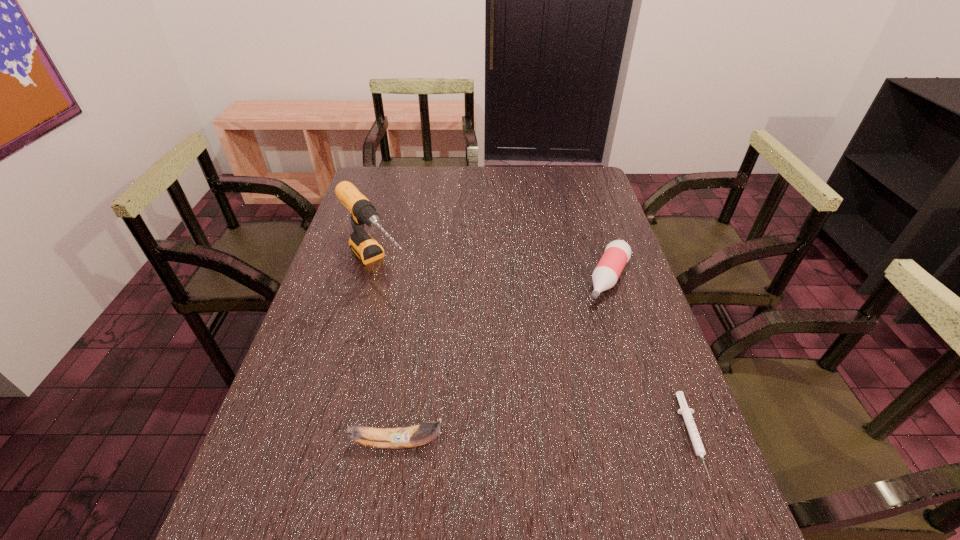
The image size is (960, 540). What are the coordinates of `free location at the right edge` in the screenshot? It's located at (606, 377).

Where is `vacant space at the far left corner of the desktop`? The height and width of the screenshot is (540, 960). vacant space at the far left corner of the desktop is located at coordinates (382, 181).

At what (x,y) coordinates should I click in order to perform the action: click on vacant space at the near left corner of the desktop. Please return your answer as a coordinate pair (x, y). This screenshot has height=540, width=960. Looking at the image, I should click on tap(286, 508).

At what (x,y) coordinates should I click in order to perform the action: click on free space between the banana and the shortest object. Please return your answer as a coordinate pair (x, y). This screenshot has height=540, width=960. Looking at the image, I should click on (545, 440).

Find the location of a particular element. vacant space that is in between the syringe and the tallest object is located at coordinates (535, 350).

Where is `free space that is in between the bottle and the tallest object`? The width and height of the screenshot is (960, 540). free space that is in between the bottle and the tallest object is located at coordinates (492, 272).

You are a GUI agent. You are given a task and a screenshot of the screen. Output one action in this format:
    pyautogui.click(x=<x>, y=<y>)
    Task: Click on the free space between the tallest object and the third shortest object
    
    Given the screenshot: What is the action you would take?
    pyautogui.click(x=387, y=354)

Identify the location of free space between the bottle and the syringe. (651, 357).

In order to click on free area in between the bottle and the second tallest object in this screenshot , I will do `click(503, 361)`.

Find the location of a particular element. free spot between the shortest object and the tallest object is located at coordinates (535, 350).